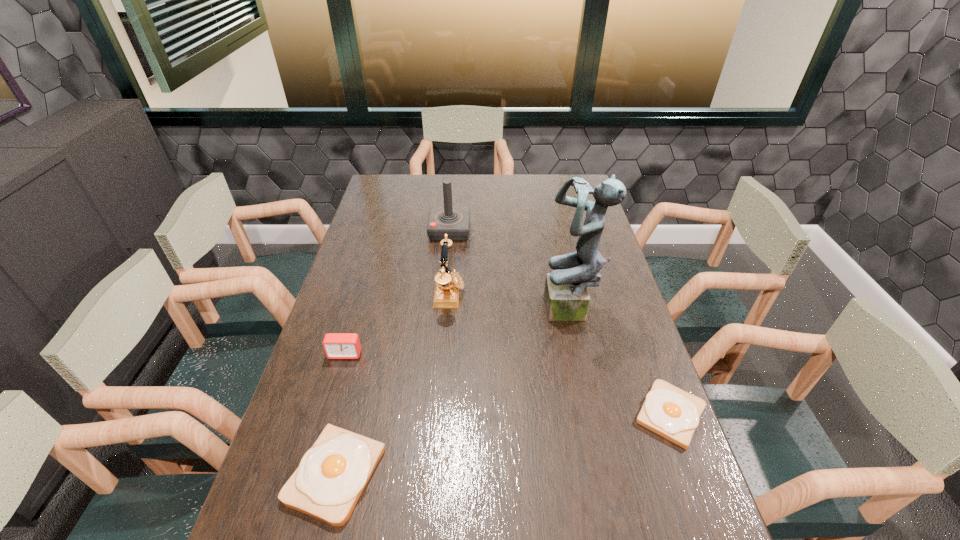
Where is `toast that is at the left edge`? This screenshot has height=540, width=960. toast that is at the left edge is located at coordinates (332, 474).

This screenshot has height=540, width=960. I want to click on alarm clock that is at the left edge, so click(x=336, y=345).

Where is `toast at the right edge`? This screenshot has width=960, height=540. toast at the right edge is located at coordinates (668, 411).

In order to click on sculpture situated at the right edge in this screenshot , I will do `click(566, 296)`.

In order to click on object located in the near left corner section of the desktop in this screenshot , I will do `click(332, 474)`.

Locate an element on the screen. This screenshot has width=960, height=540. vacant space at the far edge of the desktop is located at coordinates (527, 193).

I want to click on vacant region at the near edge, so click(576, 531).

In the image, there is a desktop. Identify the location of free space at the left edge. (348, 281).

At what (x,y) coordinates should I click in order to perform the action: click on vacant space at the right edge of the desktop. Please return your answer as a coordinate pair (x, y). Looking at the image, I should click on (615, 293).

This screenshot has width=960, height=540. In order to click on free region at the far left corner of the desktop in this screenshot , I will do `click(399, 186)`.